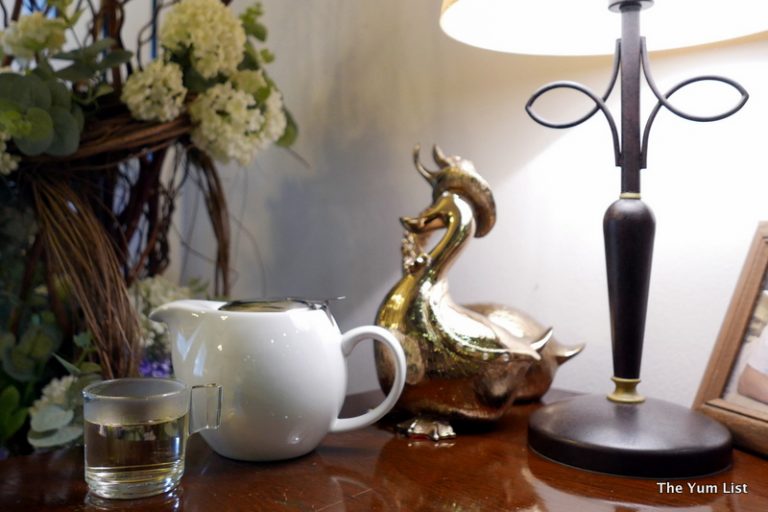
This screenshot has height=512, width=768. What are the coordinates of `pic frame` in the screenshot? It's located at (740, 312).